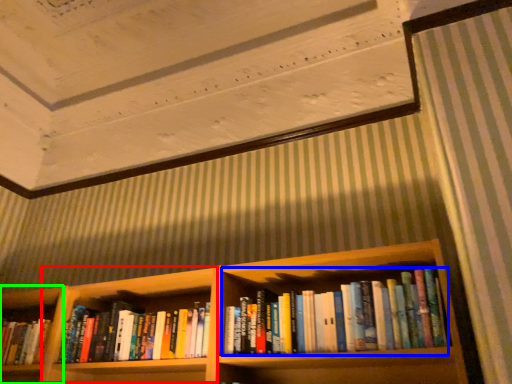
Question: Considering the real-world distances, which object is closest to cabinet (highlighted by a red box)? book (highlighted by a blue box) or shelf (highlighted by a green box).

Choices:
 (A) book
 (B) shelf

Answer: (B)